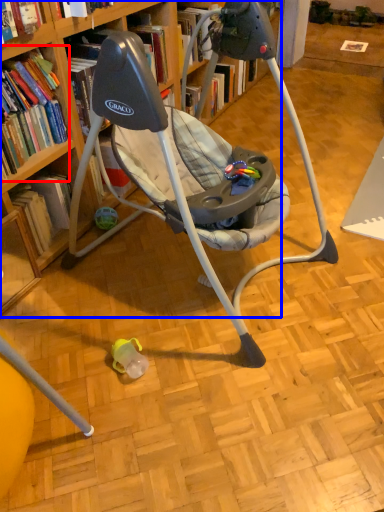
Question: Among these objects, which one is farthest to the camera, book (highlighted by a red box) or bookcase (highlighted by a blue box)?

Choices:
 (A) book
 (B) bookcase

Answer: (A)